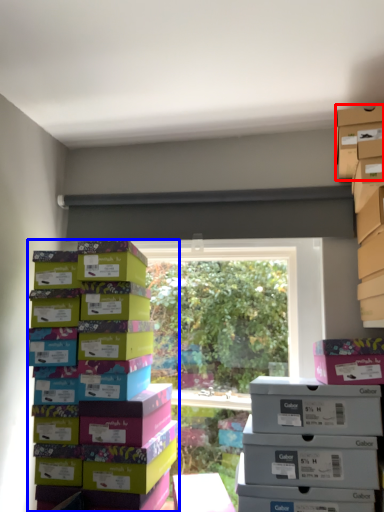
Question: Which of the following is the farthest to the observer, storage box (highlighted by a red box) or box (highlighted by a blue box)?

Choices:
 (A) storage box
 (B) box

Answer: (A)